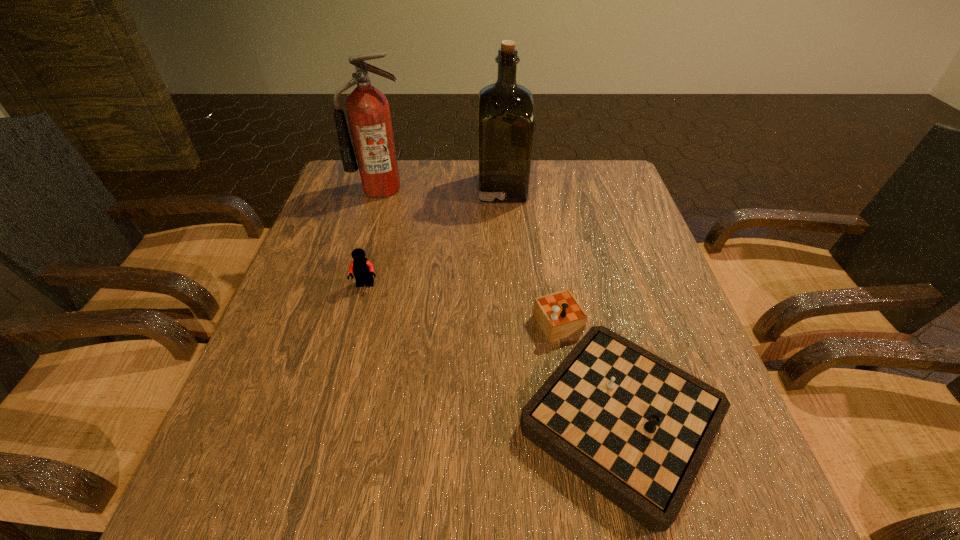
Image resolution: width=960 pixels, height=540 pixels. I want to click on vacant space at the near edge, so click(x=558, y=500).

You are a GUI agent. You are given a task and a screenshot of the screen. Output one action in this format:
    pyautogui.click(x=<x>, y=<y>)
    Task: Click on the vacant region at the left edge of the desktop
    The width and height of the screenshot is (960, 540).
    Given the screenshot: What is the action you would take?
    pyautogui.click(x=301, y=317)

Locate an element on the screen. The height and width of the screenshot is (540, 960). vacant region at the right edge is located at coordinates (645, 300).

Identify the location of vacant space at the far left corner of the desktop. This screenshot has height=540, width=960. (367, 202).

Find the location of a particular element. vacant space at the near left corner is located at coordinates (222, 484).

Where is `vacant position at the far right corner of the desktop`? This screenshot has width=960, height=540. vacant position at the far right corner of the desktop is located at coordinates (589, 178).

This screenshot has height=540, width=960. What are the coordinates of `free area in between the chessboard and the fire extinguisher` in the screenshot? It's located at (498, 293).

Locate an element on the screen. The width and height of the screenshot is (960, 540). free spot between the second nearest object and the fire extinguisher is located at coordinates (373, 237).

Where is `blank region between the third farthest object and the fire extinguisher`? Image resolution: width=960 pixels, height=540 pixels. blank region between the third farthest object and the fire extinguisher is located at coordinates (373, 237).

Locate an element on the screen. free space that is in between the fire extinguisher and the liquor is located at coordinates (442, 188).